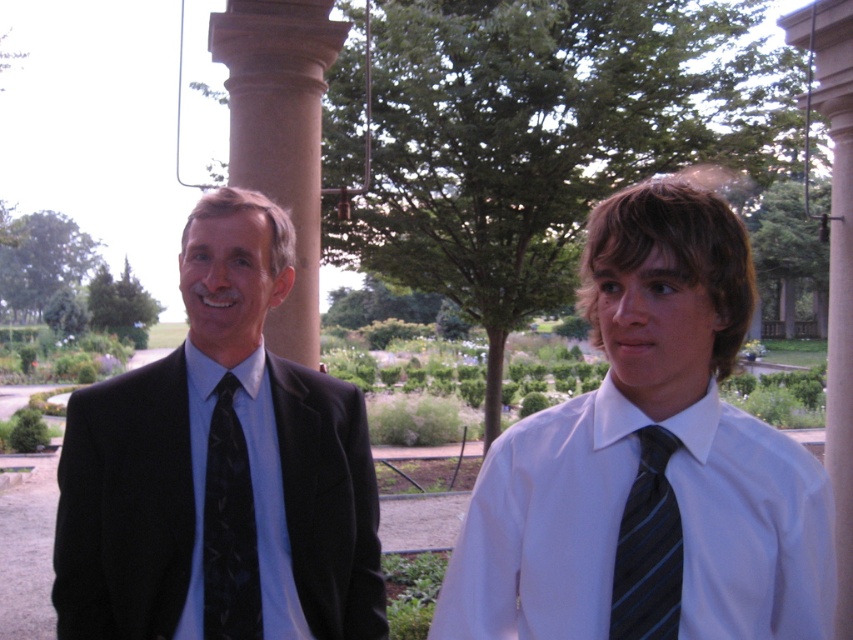
Question: Does black textured tie at left have a smaller size compared to dark blue striped tie at right?

Choices:
 (A) no
 (B) yes

Answer: (A)

Question: Which point is farther from the camera taking this photo?

Choices:
 (A) (315, 289)
 (B) (560, 452)
 (C) (846, 577)

Answer: (C)

Question: Where is white satin dress shirt at right located in relation to smooth stone pillar at center in the image?

Choices:
 (A) left
 (B) right

Answer: (A)

Question: Can you confirm if black matte suit at left is bigger than black textured tie at left?

Choices:
 (A) no
 (B) yes

Answer: (B)

Question: Which point is closer to the camera?

Choices:
 (A) (264, 45)
 (B) (218, 589)

Answer: (B)

Question: Among these points, which one is nearest to the camera?

Choices:
 (A) (645, 548)
 (B) (209, 465)
 (C) (291, 344)

Answer: (A)